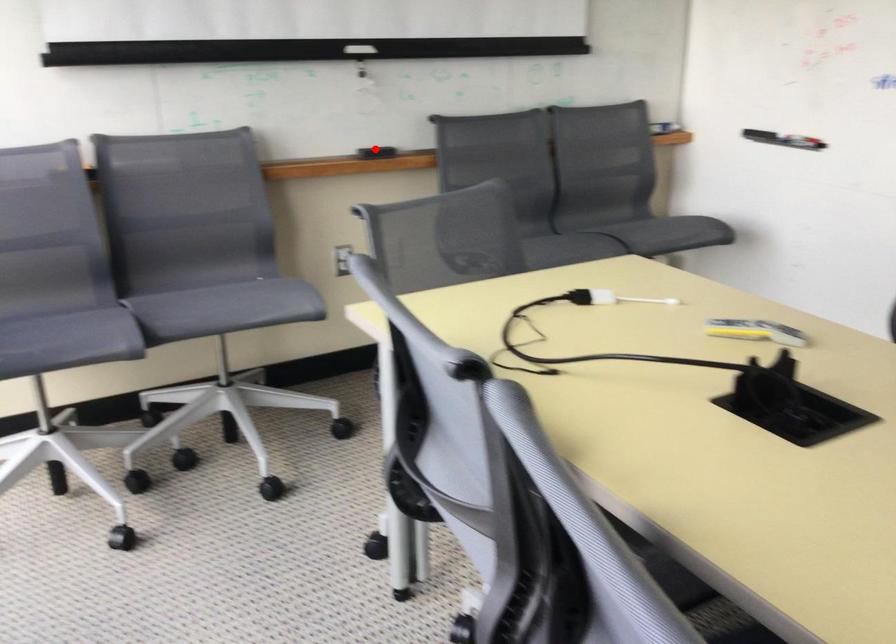
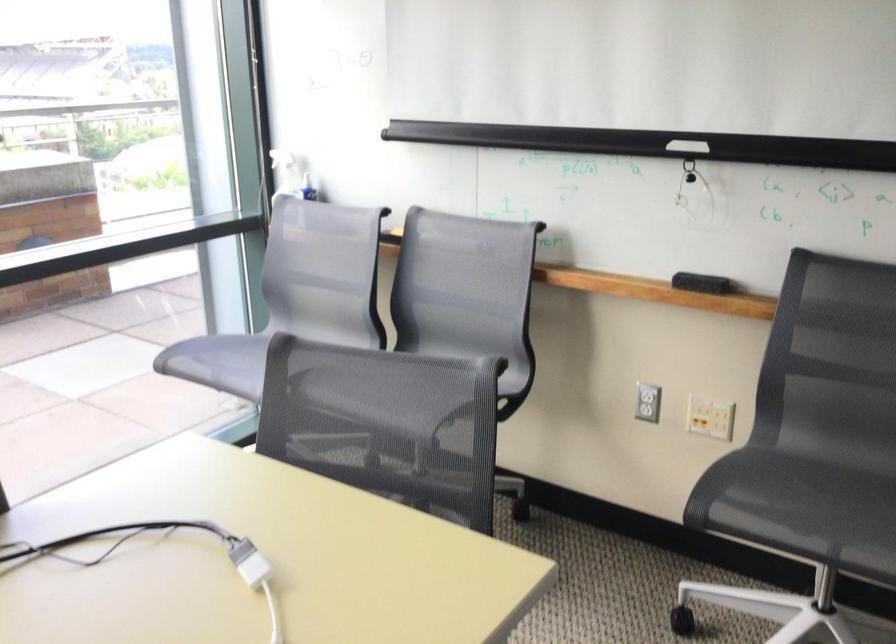
Question: A red point is marked in image1. In image2, is the corresponding 3D point closer to the camera or farther? Reply with the corresponding letter.

Choices:
 (A) The corresponding 3D point is closer.
 (B) The corresponding 3D point is farther.

Answer: (A)